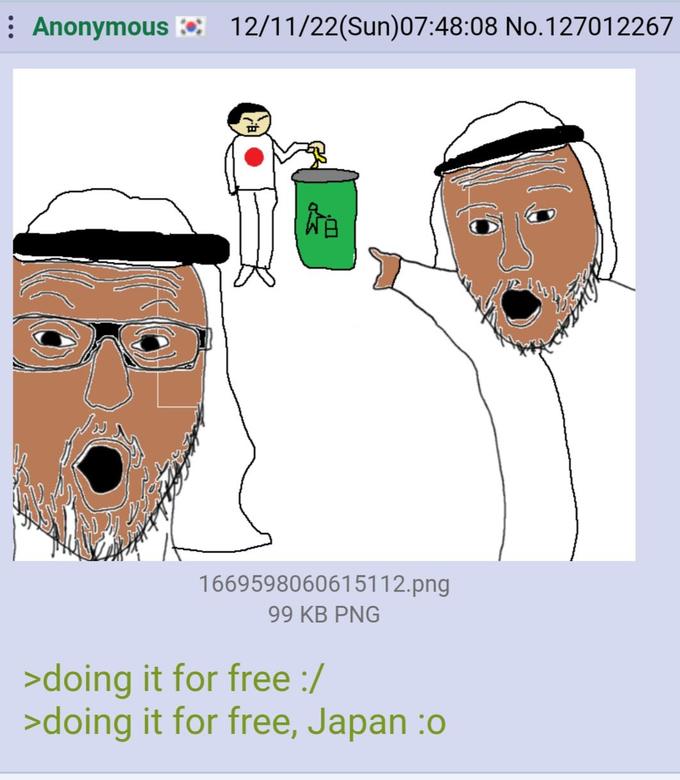
Image resolution: width=680 pixels, height=780 pixels. I want to click on trash, so click(x=320, y=147).